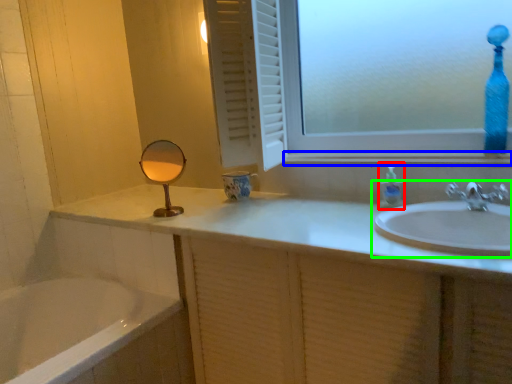
Question: Which object is the closest to the soap dispenser (highlighted by a red box)? Choose among these: window sill (highlighted by a blue box) or sink (highlighted by a green box).

Choices:
 (A) window sill
 (B) sink

Answer: (A)